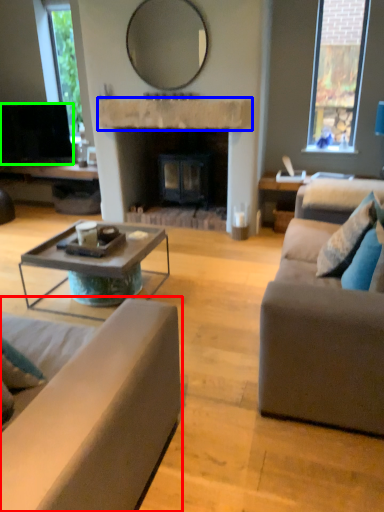
Question: Based on their relative distances, which object is farther from studio couch (highlighted by a red box)? Choose from mantle (highlighted by a blue box) and television (highlighted by a green box).

Choices:
 (A) mantle
 (B) television

Answer: (B)